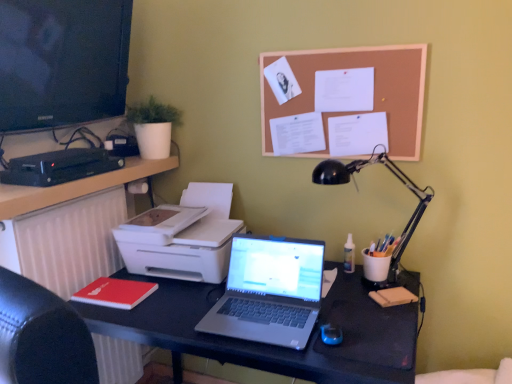
Question: Does black matte desk at center have a greater height compared to white matte radiator at left?

Choices:
 (A) yes
 (B) no

Answer: (B)

Question: Would you say black matte desk at center is a long distance from white matte radiator at left?

Choices:
 (A) yes
 (B) no

Answer: (B)

Question: From the image's perspective, is black matte desk at center on white matte radiator at left?

Choices:
 (A) yes
 (B) no

Answer: (B)

Question: From the image's perspective, is black matte desk at center located beneath white matte radiator at left?

Choices:
 (A) yes
 (B) no

Answer: (A)

Question: Does black matte desk at center appear on the right side of white matte radiator at left?

Choices:
 (A) no
 (B) yes

Answer: (B)

Question: In terms of size, does black matte desk at center appear bigger or smaller than corkboard at upper center?

Choices:
 (A) big
 (B) small

Answer: (A)

Question: Would you say black matte desk at center is inside or outside corkboard at upper center?

Choices:
 (A) inside
 (B) outside

Answer: (B)

Question: Does point (187, 347) appear closer or farther from the camera than point (421, 99)?

Choices:
 (A) closer
 (B) farther

Answer: (A)

Question: From a real-world perspective, is black matte desk at center above or below corkboard at upper center?

Choices:
 (A) below
 (B) above

Answer: (A)

Question: Considering the positions of white plastic printer at left and black metal desk lamp at right in the image, is white plastic printer at left wider or thinner than black metal desk lamp at right?

Choices:
 (A) wide
 (B) thin

Answer: (A)

Question: In terms of height, does white plastic printer at left look taller or shorter compared to black metal desk lamp at right?

Choices:
 (A) short
 (B) tall

Answer: (A)

Question: Which is correct: white plastic printer at left is inside black metal desk lamp at right, or outside of it?

Choices:
 (A) inside
 (B) outside

Answer: (B)

Question: Considering the positions of point (168, 253) and point (421, 198), is point (168, 253) closer or farther from the camera than point (421, 198)?

Choices:
 (A) farther
 (B) closer

Answer: (B)

Question: Do you think black matte desk at center is within black glossy screen at upper left, or outside of it?

Choices:
 (A) inside
 (B) outside

Answer: (B)

Question: From a real-world perspective, is black matte desk at center physically located above or below black glossy screen at upper left?

Choices:
 (A) below
 (B) above

Answer: (A)